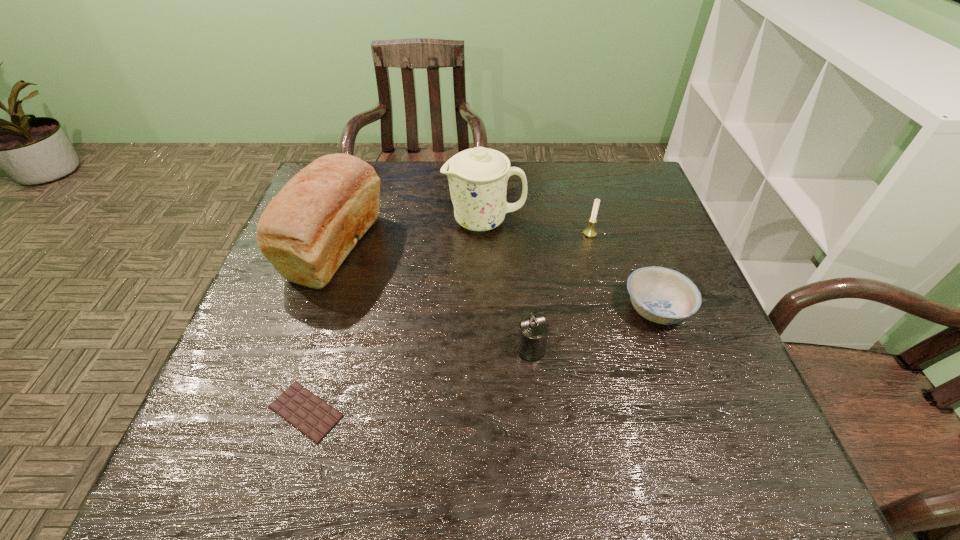
Locate an element on the screen. The image size is (960, 540). vacant space positioned on the spout of the chinaware is located at coordinates (304, 221).

At what (x,y) coordinates should I click in order to perform the action: click on vacant point located 0.190m on the right of the bread. Please return your answer as a coordinate pair (x, y). This screenshot has width=960, height=540. Looking at the image, I should click on (452, 247).

At what (x,y) coordinates should I click in order to perform the action: click on vacant space located 0.390m on the left of the second object from right to left. Please return your answer as a coordinate pair (x, y). Looking at the image, I should click on (439, 233).

The image size is (960, 540). What are the coordinates of `free space located 0.340m on the right of the second nearest object` in the screenshot? It's located at (706, 349).

Where is `vacant area located on the left of the bowl`? The width and height of the screenshot is (960, 540). vacant area located on the left of the bowl is located at coordinates (469, 309).

Identify the location of vacant space located 0.190m on the back of the nearest object. The height and width of the screenshot is (540, 960). (336, 308).

Where is `chinaware positioned at the far edge`? chinaware positioned at the far edge is located at coordinates (477, 177).

Locate an element on the screen. The height and width of the screenshot is (540, 960). bread present at the far edge is located at coordinates (308, 229).

Find the location of a particular element. Image resolution: width=960 pixels, height=540 pixels. object that is at the near edge is located at coordinates (311, 415).

You are a GUI agent. You are given a task and a screenshot of the screen. Output one action in this format:
    pyautogui.click(x=<x>, y=<y>)
    Task: Click on the bread located in the left edge section of the desktop
    
    Given the screenshot: What is the action you would take?
    pyautogui.click(x=308, y=229)